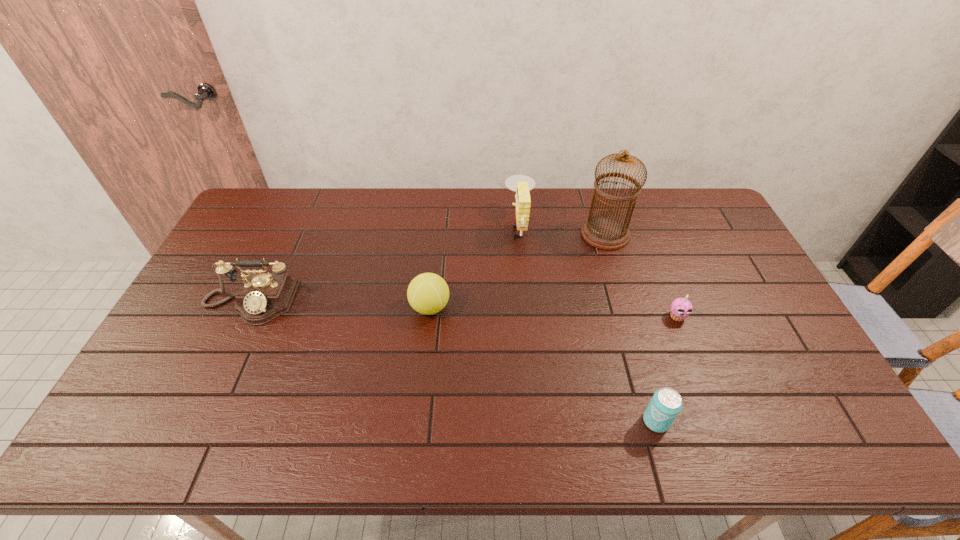
You are a GUI agent. You are given a task and a screenshot of the screen. Output one action in this format:
    pyautogui.click(x=<x>, y=<y>)
    Task: Click on the vacant position located on the front-facing side of the third object from left to right
    Image resolution: width=960 pixels, height=540 pixels.
    Given the screenshot: What is the action you would take?
    pyautogui.click(x=411, y=225)

The width and height of the screenshot is (960, 540). Identify the location of vacant space located 0.240m on the front-facing side of the third object from left to right. (437, 225).

Where is `free point located on the front-facing side of the third object from left to right`? free point located on the front-facing side of the third object from left to right is located at coordinates (443, 225).

Locate an element on the screen. free region located 0.050m on the dial of the telephone is located at coordinates (232, 341).

Identify the location of vacant position located 0.150m on the front of the second object from left to right. [423, 369].

The image size is (960, 540). I want to click on free point located on the left of the beer can, so point(521,421).

Where is `vacant space located 0.170m on the face of the shortest object`? This screenshot has width=960, height=540. vacant space located 0.170m on the face of the shortest object is located at coordinates (702, 376).

You are a GUI agent. You are given a task and a screenshot of the screen. Output one action in this format:
    pyautogui.click(x=<x>, y=<y>)
    Task: Click on the birdcage that is at the far edge
    The image size is (960, 540).
    Given the screenshot: What is the action you would take?
    pyautogui.click(x=605, y=232)

The image size is (960, 540). In order to click on sponge that is at the far edge in this screenshot , I will do `click(521, 184)`.

At what (x,y) coordinates should I click in order to perform the action: click on object present at the near edge. Please return your answer as a coordinate pair (x, y). Looking at the image, I should click on (666, 403).